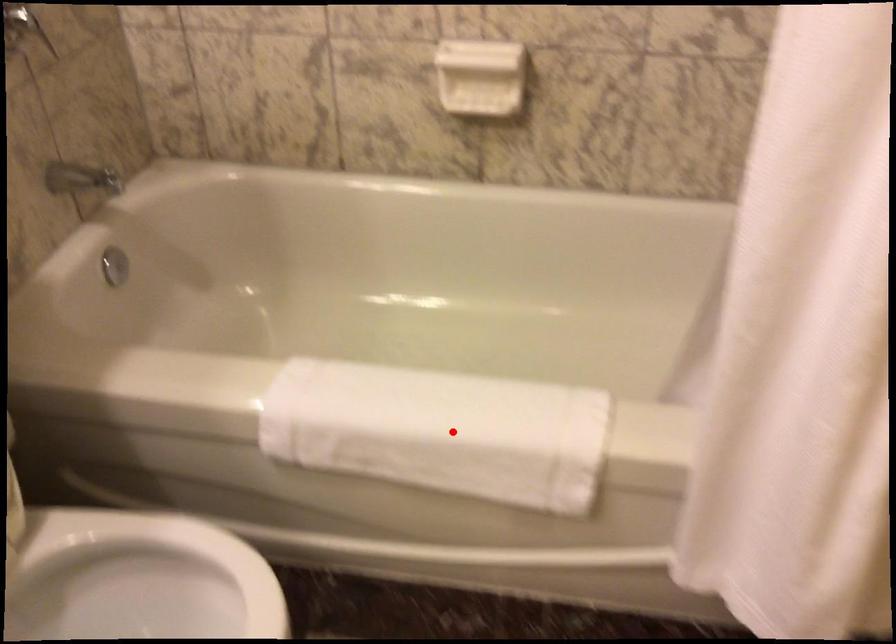
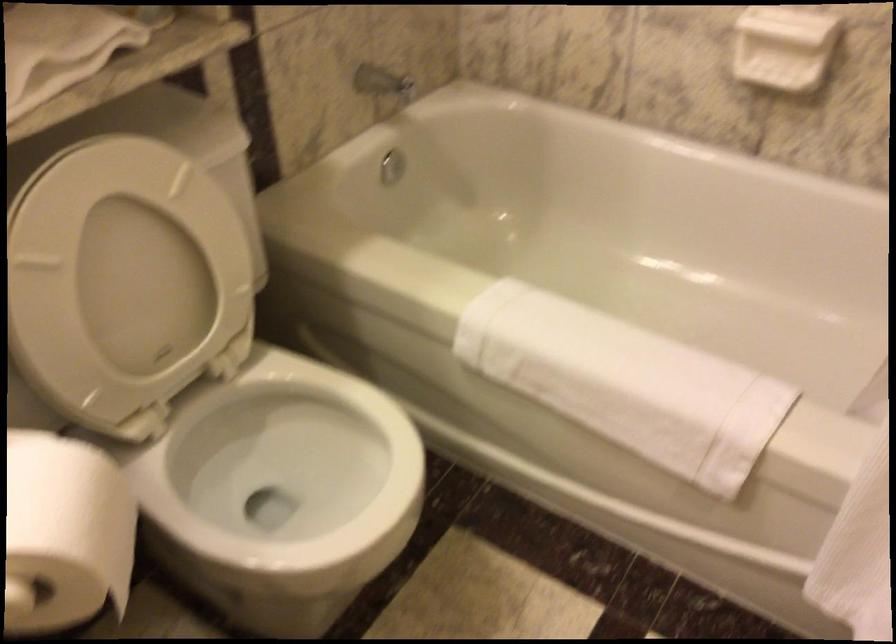
Locate, in the second image, the point that corresponds to the highlighted location in the first image.

(625, 383)